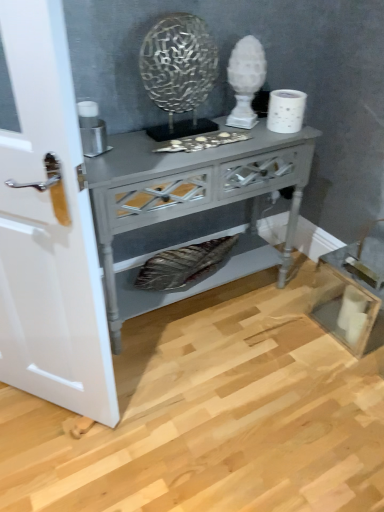
Locate an element on the screen. This screenshot has width=384, height=512. free space in front of matte gray wooden nightstand at center is located at coordinates click(x=203, y=406).